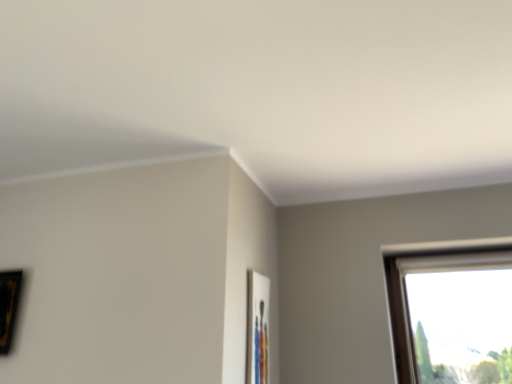
This screenshot has width=512, height=384. What do you see at coordinates (257, 328) in the screenshot?
I see `matte wooden picture frame at center-right, marked as the 1th picture frame in a right-to-left arrangement` at bounding box center [257, 328].

What is the approximate width of matte wooden picture frame at center-right, marked as the second picture frame in a left-to-right arrangement?

It is 1.33 inches.

Find the location of a particular element. This screenshot has height=384, width=512. matte wooden picture frame at center-right, marked as the 1th picture frame in a right-to-left arrangement is located at coordinates (257, 328).

Locate an element on the screen. The image size is (512, 384). wooden picture frame at left, the 1th picture frame from the left is located at coordinates (9, 306).

What do you see at coordinates (9, 306) in the screenshot? I see `wooden picture frame at left, which is counted as the 2th picture frame, starting from the right` at bounding box center [9, 306].

Locate an element on the screen. Image resolution: width=512 pixels, height=384 pixels. matte wooden picture frame at center-right, marked as the 1th picture frame in a right-to-left arrangement is located at coordinates (257, 328).

Which is more to the right, matte wooden picture frame at center-right, marked as the 1th picture frame in a right-to-left arrangement, or wooden picture frame at left, which is counted as the 2th picture frame, starting from the right?

Positioned to the right is matte wooden picture frame at center-right, marked as the 1th picture frame in a right-to-left arrangement.

Is matte wooden picture frame at center-right, marked as the 1th picture frame in a right-to-left arrangement, behind wooden picture frame at left, the 1th picture frame from the left?

No, the depth of matte wooden picture frame at center-right, marked as the 1th picture frame in a right-to-left arrangement, is less than that of wooden picture frame at left, the 1th picture frame from the left.

Is point (249, 296) closer or farther from the camera than point (22, 271)?

Point (249, 296).

From the image's perspective, is matte wooden picture frame at center-right, marked as the 1th picture frame in a right-to-left arrangement, on top of wooden picture frame at left, the 1th picture frame from the left?

Incorrect, from the image's perspective, matte wooden picture frame at center-right, marked as the 1th picture frame in a right-to-left arrangement, is lower than wooden picture frame at left, the 1th picture frame from the left.

From a real-world perspective, is matte wooden picture frame at center-right, marked as the second picture frame in a left-to-right arrangement, positioned above or below wooden picture frame at left, the 1th picture frame from the left?

Clearly, from a real-world perspective, matte wooden picture frame at center-right, marked as the second picture frame in a left-to-right arrangement, is below wooden picture frame at left, the 1th picture frame from the left.

Is matte wooden picture frame at center-right, marked as the 1th picture frame in a right-to-left arrangement, wider than wooden picture frame at left, which is counted as the 2th picture frame, starting from the right?

No, matte wooden picture frame at center-right, marked as the 1th picture frame in a right-to-left arrangement, is not wider than wooden picture frame at left, which is counted as the 2th picture frame, starting from the right.

Does matte wooden picture frame at center-right, marked as the 1th picture frame in a right-to-left arrangement, have a greater height compared to wooden picture frame at left, the 1th picture frame from the left?

Indeed, matte wooden picture frame at center-right, marked as the 1th picture frame in a right-to-left arrangement, has a greater height compared to wooden picture frame at left, the 1th picture frame from the left.

Can you confirm if matte wooden picture frame at center-right, marked as the 1th picture frame in a right-to-left arrangement, is smaller than wooden picture frame at left, which is counted as the 2th picture frame, starting from the right?

Correct, matte wooden picture frame at center-right, marked as the 1th picture frame in a right-to-left arrangement, occupies less space than wooden picture frame at left, which is counted as the 2th picture frame, starting from the right.

Would you say matte wooden picture frame at center-right, marked as the 1th picture frame in a right-to-left arrangement, is outside wooden picture frame at left, which is counted as the 2th picture frame, starting from the right?

Yes, matte wooden picture frame at center-right, marked as the 1th picture frame in a right-to-left arrangement, is located beyond the bounds of wooden picture frame at left, which is counted as the 2th picture frame, starting from the right.

Is matte wooden picture frame at center-right, marked as the second picture frame in a left-to-right arrangement, not near wooden picture frame at left, the 1th picture frame from the left?

Absolutely, matte wooden picture frame at center-right, marked as the second picture frame in a left-to-right arrangement, is distant from wooden picture frame at left, the 1th picture frame from the left.

Is matte wooden picture frame at center-right, marked as the second picture frame in a left-to-right arrangement, oriented towards wooden picture frame at left, which is counted as the 2th picture frame, starting from the right?

No, matte wooden picture frame at center-right, marked as the second picture frame in a left-to-right arrangement, is not turned towards wooden picture frame at left, which is counted as the 2th picture frame, starting from the right.

How different are the orientations of matte wooden picture frame at center-right, marked as the 1th picture frame in a right-to-left arrangement, and wooden picture frame at left, which is counted as the 2th picture frame, starting from the right, in degrees?

The angular difference between matte wooden picture frame at center-right, marked as the 1th picture frame in a right-to-left arrangement, and wooden picture frame at left, which is counted as the 2th picture frame, starting from the right, is 88.9 degrees.

Identify the location of picture frame located on the left of matte wooden picture frame at center-right, marked as the 1th picture frame in a right-to-left arrangement. (9, 306).

Between wooden picture frame at left, the 1th picture frame from the left, and matte wooden picture frame at center-right, marked as the second picture frame in a left-to-right arrangement, which one appears on the right side from the viewer's perspective?

From the viewer's perspective, matte wooden picture frame at center-right, marked as the second picture frame in a left-to-right arrangement, appears more on the right side.

Which is behind, wooden picture frame at left, which is counted as the 2th picture frame, starting from the right, or matte wooden picture frame at center-right, marked as the 1th picture frame in a right-to-left arrangement?

wooden picture frame at left, which is counted as the 2th picture frame, starting from the right, is more distant.

Which is further, (7, 338) or (258, 343)?

The point (7, 338) is farther from the camera.

From the image's perspective, relative to matte wooden picture frame at center-right, marked as the second picture frame in a left-to-right arrangement, is wooden picture frame at left, which is counted as the 2th picture frame, starting from the right, above or below?

From the image's perspective, wooden picture frame at left, which is counted as the 2th picture frame, starting from the right, appears above matte wooden picture frame at center-right, marked as the second picture frame in a left-to-right arrangement.

From a real-world perspective, is wooden picture frame at left, the 1th picture frame from the left, on top of matte wooden picture frame at center-right, marked as the 1th picture frame in a right-to-left arrangement?

Correct, in the physical world, wooden picture frame at left, the 1th picture frame from the left, is higher than matte wooden picture frame at center-right, marked as the 1th picture frame in a right-to-left arrangement.

Is wooden picture frame at left, the 1th picture frame from the left, thinner than matte wooden picture frame at center-right, marked as the 1th picture frame in a right-to-left arrangement?

No.

Who is shorter, wooden picture frame at left, which is counted as the 2th picture frame, starting from the right, or matte wooden picture frame at center-right, marked as the 1th picture frame in a right-to-left arrangement?

With less height is wooden picture frame at left, which is counted as the 2th picture frame, starting from the right.

Is wooden picture frame at left, which is counted as the 2th picture frame, starting from the right, bigger than matte wooden picture frame at center-right, marked as the second picture frame in a left-to-right arrangement?

Yes.

Is wooden picture frame at left, which is counted as the 2th picture frame, starting from the right, located outside matte wooden picture frame at center-right, marked as the second picture frame in a left-to-right arrangement?

Yes, wooden picture frame at left, which is counted as the 2th picture frame, starting from the right, is located beyond the bounds of matte wooden picture frame at center-right, marked as the second picture frame in a left-to-right arrangement.

Are wooden picture frame at left, which is counted as the 2th picture frame, starting from the right, and matte wooden picture frame at center-right, marked as the 1th picture frame in a right-to-left arrangement, beside each other?

No, wooden picture frame at left, which is counted as the 2th picture frame, starting from the right, is not next to matte wooden picture frame at center-right, marked as the 1th picture frame in a right-to-left arrangement.

Is wooden picture frame at left, the 1th picture frame from the left, positioned with its back to matte wooden picture frame at center-right, marked as the 1th picture frame in a right-to-left arrangement?

No, matte wooden picture frame at center-right, marked as the 1th picture frame in a right-to-left arrangement, is not at the back of wooden picture frame at left, the 1th picture frame from the left.

What's the angular difference between wooden picture frame at left, the 1th picture frame from the left, and matte wooden picture frame at center-right, marked as the 1th picture frame in a right-to-left arrangement,'s facing directions?

The angle between the facing direction of wooden picture frame at left, the 1th picture frame from the left, and the facing direction of matte wooden picture frame at center-right, marked as the 1th picture frame in a right-to-left arrangement, is 88.9 degrees.

Could you measure the distance between wooden picture frame at left, the 1th picture frame from the left, and matte wooden picture frame at center-right, marked as the 1th picture frame in a right-to-left arrangement?

The distance of wooden picture frame at left, the 1th picture frame from the left, from matte wooden picture frame at center-right, marked as the 1th picture frame in a right-to-left arrangement, is 3.43 feet.

The height and width of the screenshot is (384, 512). Find the location of `picture frame that appears in front of the wooden picture frame at left, the 1th picture frame from the left`. picture frame that appears in front of the wooden picture frame at left, the 1th picture frame from the left is located at coordinates (257, 328).

Locate an element on the screen. The height and width of the screenshot is (384, 512). picture frame located on the right of wooden picture frame at left, which is counted as the 2th picture frame, starting from the right is located at coordinates (257, 328).

Locate an element on the screen. The width and height of the screenshot is (512, 384). picture frame above the matte wooden picture frame at center-right, marked as the second picture frame in a left-to-right arrangement (from the image's perspective) is located at coordinates (9, 306).